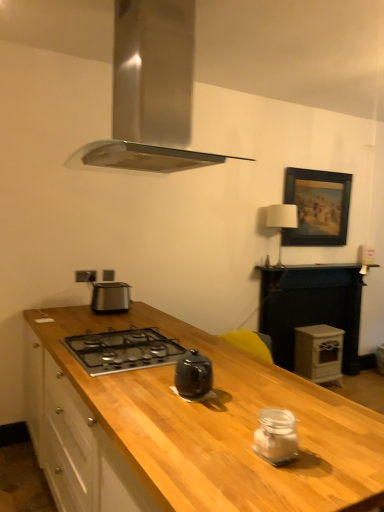
Question: From the image's perspective, is wooden at right on white matte wood stove at right?

Choices:
 (A) yes
 (B) no

Answer: (A)

Question: Is wooden at right facing away from white matte wood stove at right?

Choices:
 (A) yes
 (B) no

Answer: (A)

Question: Is white matte wood stove at right surrounded by wooden at right?

Choices:
 (A) yes
 (B) no

Answer: (A)

Question: Is wooden at right in front of white matte wood stove at right?

Choices:
 (A) yes
 (B) no

Answer: (A)

Question: Can you confirm if wooden at right is shorter than white matte wood stove at right?

Choices:
 (A) no
 (B) yes

Answer: (A)

Question: From their relative heights in the image, would you say clear glass jar at center, which ranks as the 1th kitchen appliance in bottom-to-top order, is taller or shorter than white fabric lampshade at upper right?

Choices:
 (A) tall
 (B) short

Answer: (B)

Question: In the image, is clear glass jar at center, which is the 2th kitchen appliance from back to front, positioned in front of or behind white fabric lampshade at upper right?

Choices:
 (A) behind
 (B) front

Answer: (B)

Question: Is clear glass jar at center, which ranks as the 1th kitchen appliance in right-to-left order, inside the boundaries of white fabric lampshade at upper right, or outside?

Choices:
 (A) outside
 (B) inside

Answer: (A)

Question: Looking at their shapes, would you say clear glass jar at center, which ranks as the 1th kitchen appliance in bottom-to-top order, is wider or thinner than white fabric lampshade at upper right?

Choices:
 (A) wide
 (B) thin

Answer: (B)

Question: Considering the positions of wooden at right and clear glass jar at center, which appears as the first kitchen appliance when viewed from the front, in the image, is wooden at right wider or thinner than clear glass jar at center, which appears as the first kitchen appliance when viewed from the front,?

Choices:
 (A) thin
 (B) wide

Answer: (B)

Question: Is point (311, 302) closer or farther from the camera than point (266, 416)?

Choices:
 (A) closer
 (B) farther

Answer: (B)

Question: From a real-world perspective, is wooden at right positioned above or below clear glass jar at center, which is the 2th kitchen appliance from back to front?

Choices:
 (A) below
 (B) above

Answer: (A)

Question: In terms of height, does wooden at right look taller or shorter compared to clear glass jar at center, which ranks as the 1th kitchen appliance in bottom-to-top order?

Choices:
 (A) tall
 (B) short

Answer: (A)

Question: Is point (135, 53) closer or farther from the camera than point (317, 331)?

Choices:
 (A) closer
 (B) farther

Answer: (A)

Question: Based on their sizes in the image, would you say stainless steel range hood at upper center is bigger or smaller than white matte wood stove at right?

Choices:
 (A) big
 (B) small

Answer: (A)